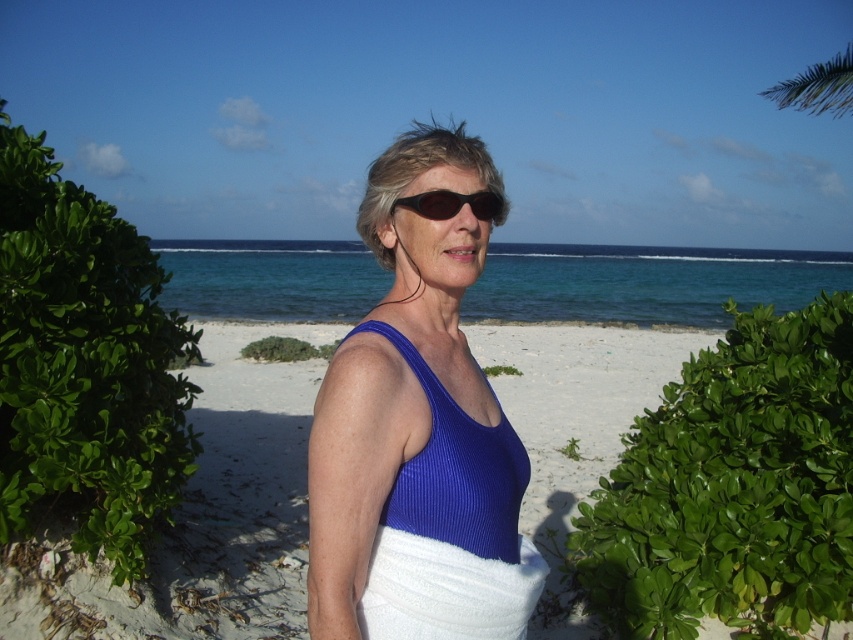
Question: Which object is positioned farthest from the white terry cloth towel at lower center?

Choices:
 (A) green leafy palm tree at upper right
 (B) blue ribbed tank top at center

Answer: (A)

Question: Based on their relative distances, which object is nearer to the white terry cloth towel at lower center?

Choices:
 (A) white sand at center
 (B) black plastic sunglasses at center
 (C) green leafy palm tree at upper right
 (D) blue ribbed tank top at center

Answer: (D)

Question: Is blue ribbed tank top at center positioned behind black plastic sunglasses at center?

Choices:
 (A) yes
 (B) no

Answer: (B)

Question: Can you confirm if white sand at center is smaller than white terry cloth towel at lower center?

Choices:
 (A) no
 (B) yes

Answer: (A)

Question: Can you confirm if white sand at center is positioned to the right of black plastic sunglasses at center?

Choices:
 (A) yes
 (B) no

Answer: (B)

Question: Which object appears farthest from the camera in this image?

Choices:
 (A) white sand at center
 (B) white terry cloth towel at lower center
 (C) blue ribbed tank top at center
 (D) green leafy palm tree at upper right

Answer: (D)